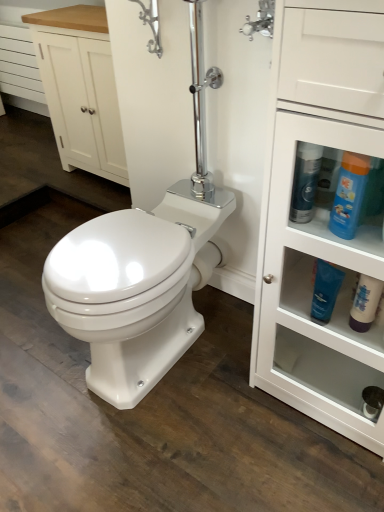
The image size is (384, 512). I want to click on vacant area to the left of white glossy cabinet at right, so click(222, 413).